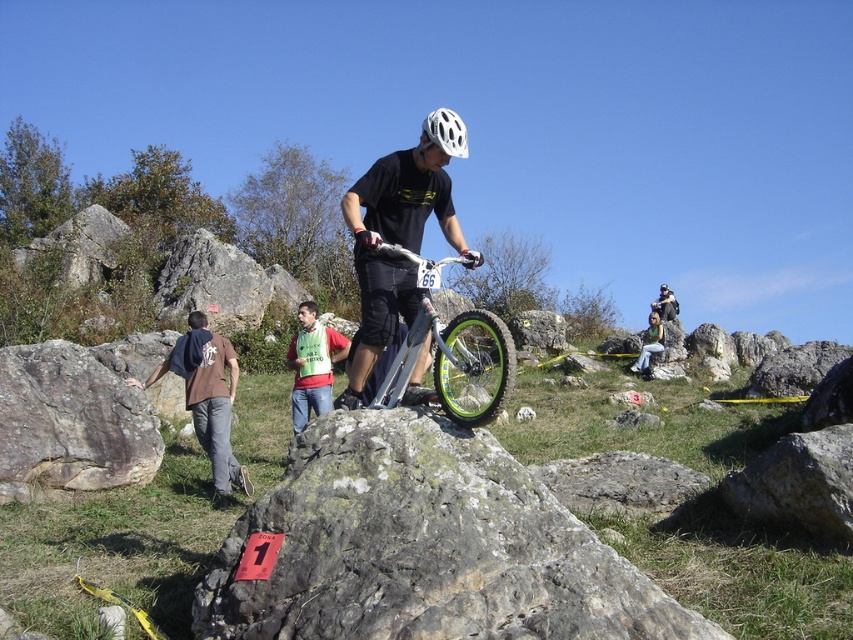
You are standing at the point labeled point (144, 422) and want to walk to the nearest boulder. The nearest boulder is 5 meters away from you. Can you reach it without crossing any rocks larger than 2 meters in diameter?

The point labeled point (144, 422) is 8.87 meters away from the viewer. However, the nearest boulder is only 5 meters away, so you can reach it without crossing any rocks larger than 2 meters in diameter.

You are a photographer positioned at the starting line of a mountain biking race. You need to capture a photo of the white matte bicycle helmet at center and the gray rough rock at left. Based on their positions, which object should you adjust your camera focus to first to ensure both are in frame?

The gray rough rock at left is located below the white matte bicycle helmet at center, so you should focus on the gray rough rock at left first to ensure both are in frame.

You are a drone operator trying to capture the silver metallic mountain bike at center for a closeup shot. The drone is currently at point 0.5,0.5. Should you move the drone to the left or right to align with the bike?

The silver metallic mountain bike at center is located at point (456, 364). Since the drone is at (426, 320), you should move it to the right and slightly downward to align with the bike.